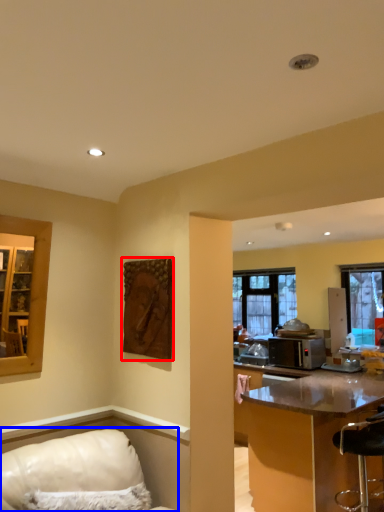
Question: Which object is closer to the camera taking this photo, picture frame (highlighted by a red box) or furniture (highlighted by a blue box)?

Choices:
 (A) picture frame
 (B) furniture

Answer: (B)